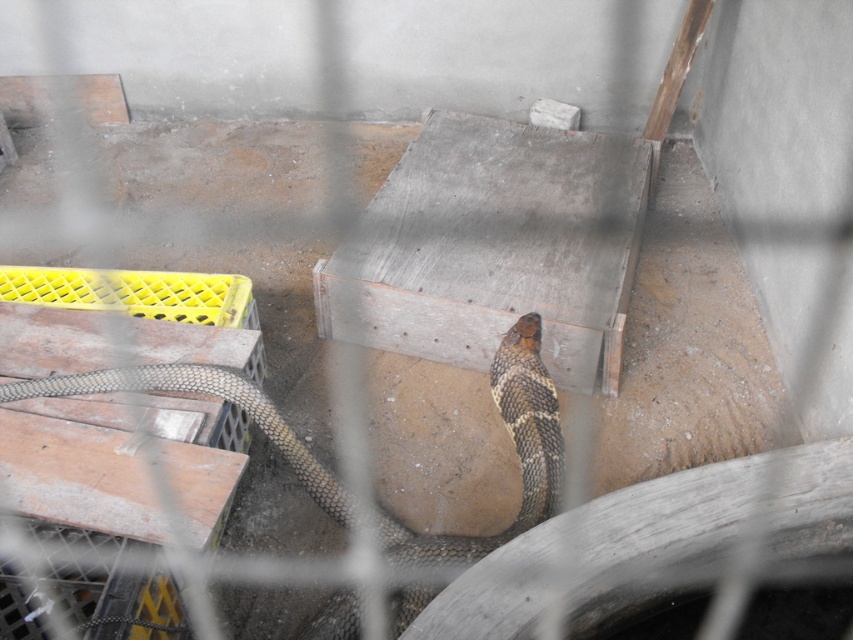
Based on the photo, is yellow plastic crate at lower left positioned before brown scaly snake at center?

Yes, yellow plastic crate at lower left is in front of brown scaly snake at center.

Who is taller, yellow plastic crate at lower left or brown scaly snake at center?

yellow plastic crate at lower left

Locate an element on the screen. yellow plastic crate at lower left is located at coordinates (122, 461).